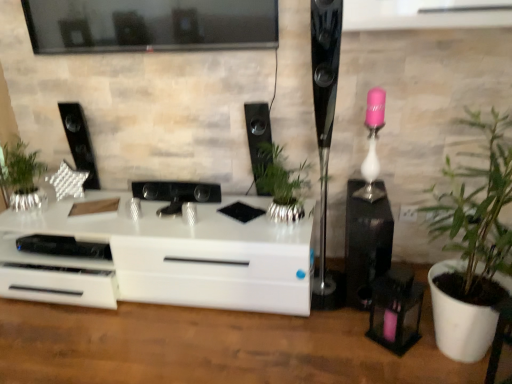
Question: Do you think green leafy plant at right, which is counted as the 3th houseplant, starting from the left, is within black glossy speaker at center, which ranks as the 3th speaker in right-to-left order, or outside of it?

Choices:
 (A) inside
 (B) outside

Answer: (B)

Question: From the image's perspective, is green leafy plant at right, which is counted as the 3th houseplant, starting from the left, located above or below black glossy speaker at center, which ranks as the 3th speaker in right-to-left order?

Choices:
 (A) below
 (B) above

Answer: (A)

Question: Which object is positioned farthest from the silver metallic plant at left, which ranks as the 1th houseplant in left-to-right order?

Choices:
 (A) white glossy chest of drawers at center
 (B) black textured speaker at left, the 1th speaker viewed from the left
 (C) black glossy speaker at center, which ranks as the 3th speaker in right-to-left order
 (D) black glossy speaker at right, which ranks as the 4th speaker in left-to-right order
 (E) green leafy plant at right, which is counted as the 3th houseplant, starting from the left

Answer: (E)

Question: Which object is the closest to the silver metallic plant at left, which ranks as the 1th houseplant in left-to-right order?

Choices:
 (A) green leafy plant at right, the 1th houseplant when ordered from right to left
 (B) black glossy speaker at right, the 1th speaker viewed from the right
 (C) white glossy chest of drawers at center
 (D) silver metallic plant pot at center, acting as the 2th houseplant starting from the left
 (E) black glossy speaker at center, which appears as the 2th speaker when viewed from the left

Answer: (C)